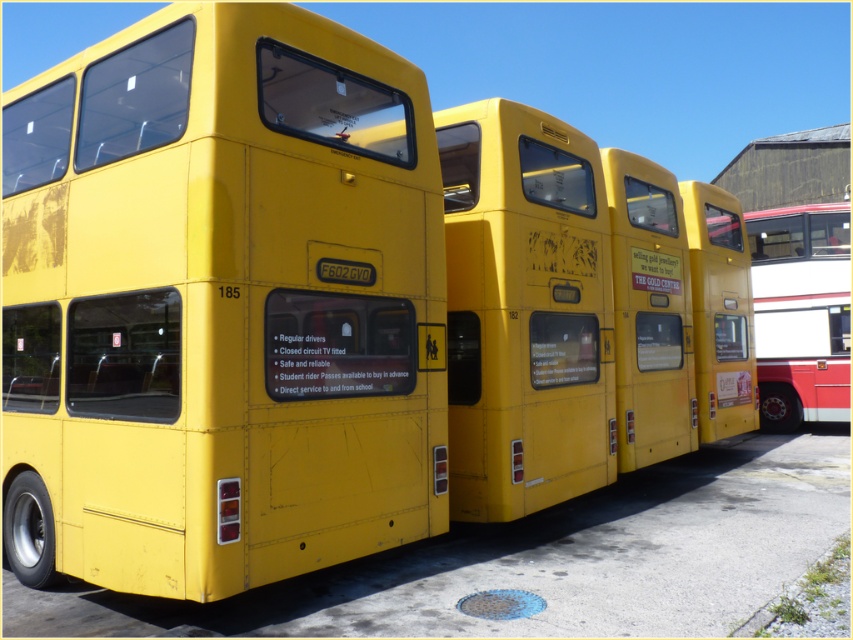
You are a bus inspector standing in front of the row of buses. You need to check the service information on both the matte yellow bus at left and the yellow matte bus at center. Which bus should you approach first to check the service information?

The matte yellow bus at left is closer to the viewer than the yellow matte bus at center, so you should approach the matte yellow bus at left first to check the service information.

You are standing at the bus depot and see the point marked at coordinates (556, 310). Which bus does this point correspond to?

The point at coordinates (556, 310) corresponds to the yellow matte bus at center.